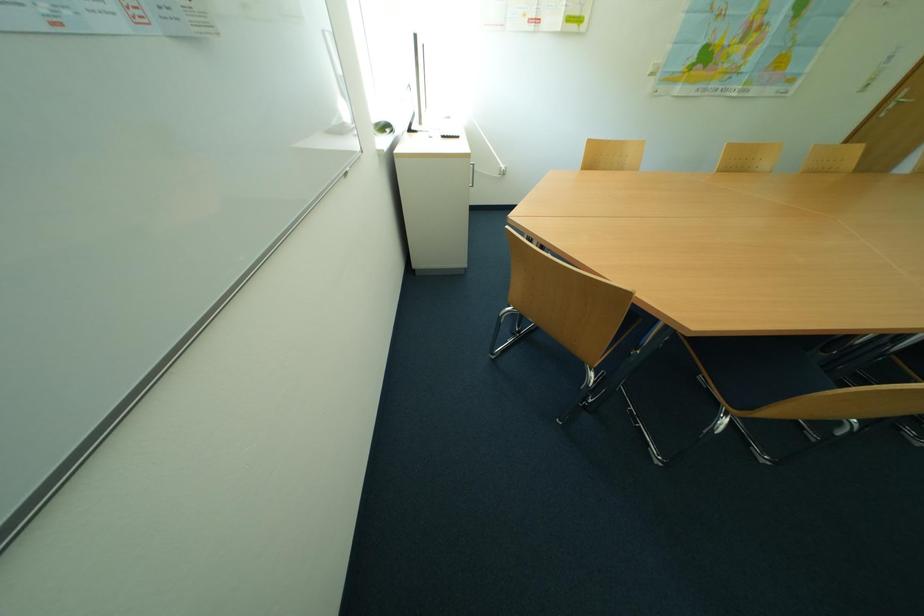
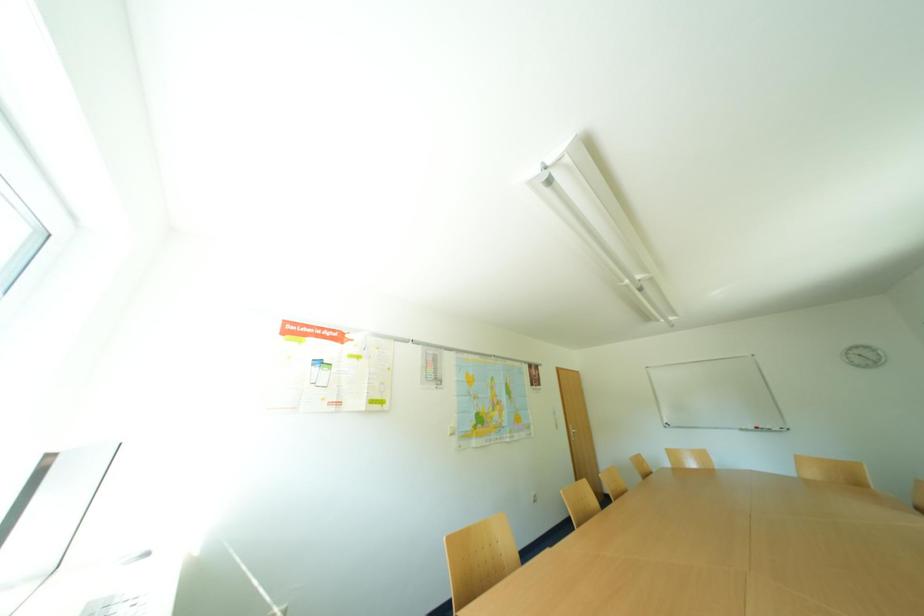
The first image is from the beginning of the video and the second image is from the end. How did the camera likely rotate when shooting the video?

The camera rotated toward right-up.